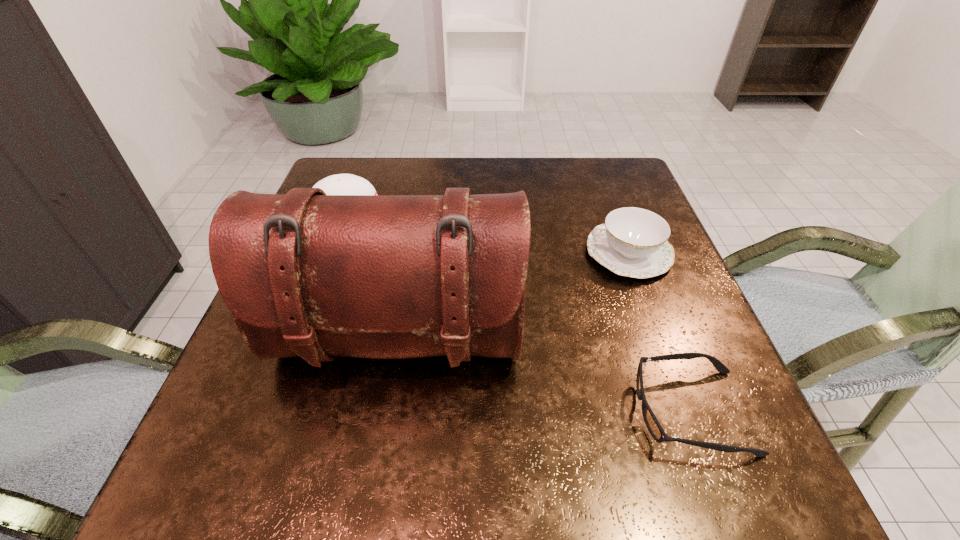
The width and height of the screenshot is (960, 540). What are the coordinates of `vacant point located between the second shortest object and the spectacles` in the screenshot? It's located at (660, 332).

Locate which object is the third closest to the tallest object. Please provide its 2D coordinates. Your answer should be formatted as a tuple, i.e. [(x, y)], where the tuple contains the x and y coordinates of a point satisfying the conditions above.

[(340, 184)]

Locate an element on the screen. The height and width of the screenshot is (540, 960). the second closest object to the tallest object is located at coordinates (652, 424).

Where is `free space that satisfies the following two spatial constraints: 1. on the handle side of the third tallest object; 2. on the front-facing side of the satchel`? This screenshot has height=540, width=960. free space that satisfies the following two spatial constraints: 1. on the handle side of the third tallest object; 2. on the front-facing side of the satchel is located at coordinates (661, 340).

Identify the location of vacant region that satisfies the following two spatial constraints: 1. on the handle side of the third tallest object; 2. on the front-facing side of the tallest object. (661, 340).